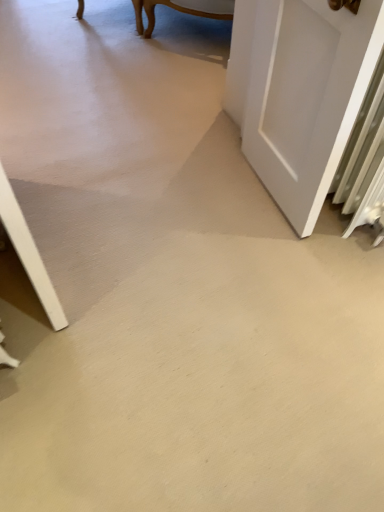
Locate an element on the screen. The image size is (384, 512). vacant space in white matte door at right (from a real-world perspective) is located at coordinates (263, 197).